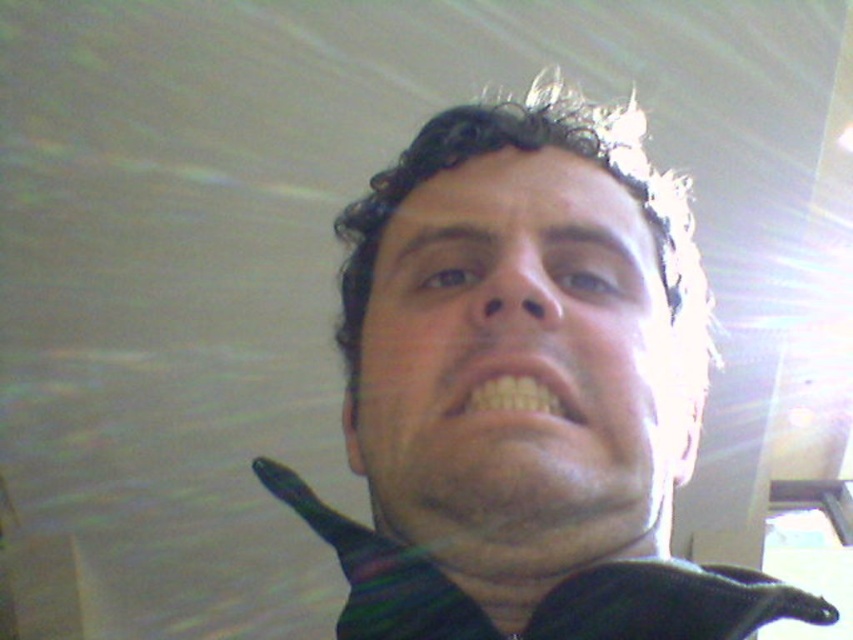
Can you confirm if black matte face at center is shorter than matte black face at center?

In fact, black matte face at center may be taller than matte black face at center.

Is black matte face at center bigger than matte black face at center?

Correct, black matte face at center is larger in size than matte black face at center.

Is point (570, 224) closer to viewer compared to point (509, 410)?

No, it is behind (509, 410).

Find the location of `black matte face at center`. black matte face at center is located at coordinates (544, 376).

Is point (544, 205) less distant than point (791, 605)?

No.

In the scene shown: Can you confirm if matte black face at center is positioned to the left of striped fabric dress shirt at center?

Correct, you'll find matte black face at center to the left of striped fabric dress shirt at center.

Identify the location of matte black face at center. (515, 355).

Is black matte face at center behind yellow matte teeth at center?

No, black matte face at center is closer to the viewer.

Between black matte face at center and yellow matte teeth at center, which one has less height?

A: With less height is yellow matte teeth at center.

Does point (683, 244) come closer to viewer compared to point (485, 396)?

No, (683, 244) is behind (485, 396).

At what (x,y) coordinates should I click in order to perform the action: click on black matte face at center. Please return your answer as a coordinate pair (x, y). The height and width of the screenshot is (640, 853). Looking at the image, I should click on [x=544, y=376].